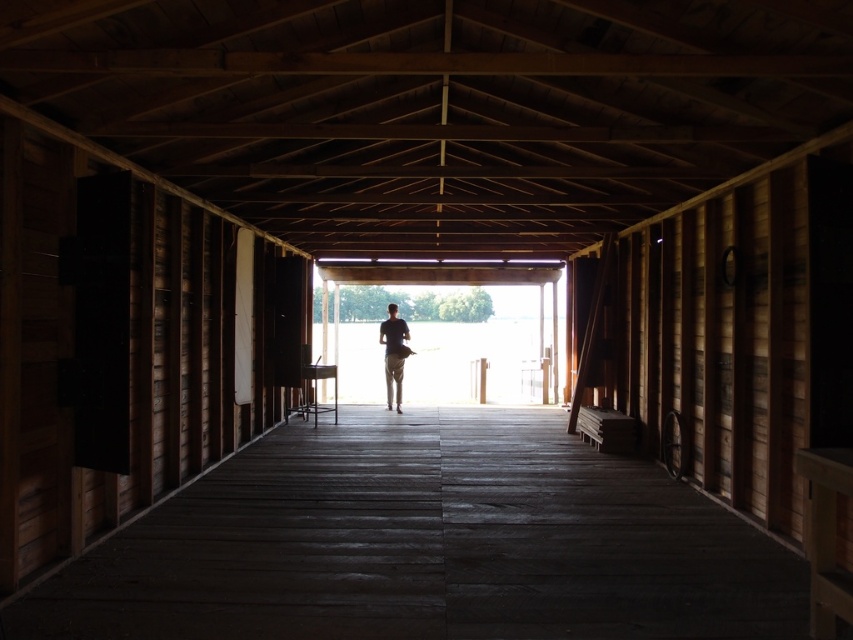
Is dark wood floor at center further to the viewer compared to dark gray fabric shirt at center?

No.

Based on the photo, who is lower down, dark wood floor at center or dark gray fabric shirt at center?

dark wood floor at center is below.

Between point (305, 506) and point (393, 339), which one is positioned behind?

Point (393, 339)

The width and height of the screenshot is (853, 640). Identify the location of dark wood floor at center. (426, 545).